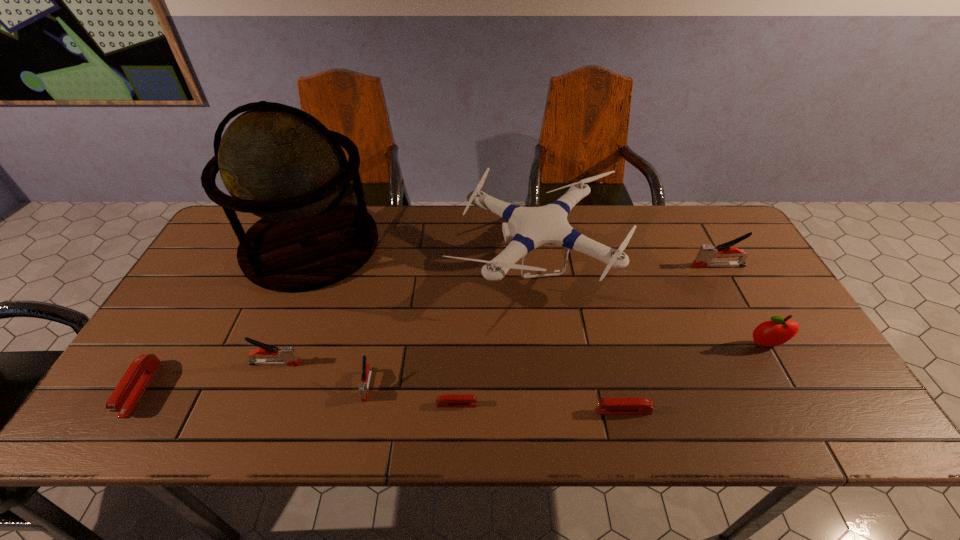
Locate an element on the screen. stapler that is at the left edge is located at coordinates (129, 390).

Where is `stapler situated at the right edge`? This screenshot has height=540, width=960. stapler situated at the right edge is located at coordinates (706, 253).

Image resolution: width=960 pixels, height=540 pixels. I want to click on apple located in the right edge section of the desktop, so click(x=777, y=331).

The width and height of the screenshot is (960, 540). In order to click on object that is positioned at the far left corner in this screenshot , I will do `click(280, 163)`.

This screenshot has width=960, height=540. I want to click on object that is positioned at the near left corner, so click(129, 390).

In the image, there is a desktop. What are the coordinates of `free space at the far edge` in the screenshot? It's located at (611, 206).

Where is `vacant space at the near edge`? vacant space at the near edge is located at coordinates (630, 422).

Locate an element on the screen. The height and width of the screenshot is (540, 960). vacant space at the left edge of the desktop is located at coordinates (228, 323).

At what (x,y) coordinates should I click in order to perform the action: click on vacant point at the right edge. Please return your answer as a coordinate pair (x, y). Looking at the image, I should click on (709, 275).

Where is `vacant point at the far right corner`? The image size is (960, 540). vacant point at the far right corner is located at coordinates (698, 218).